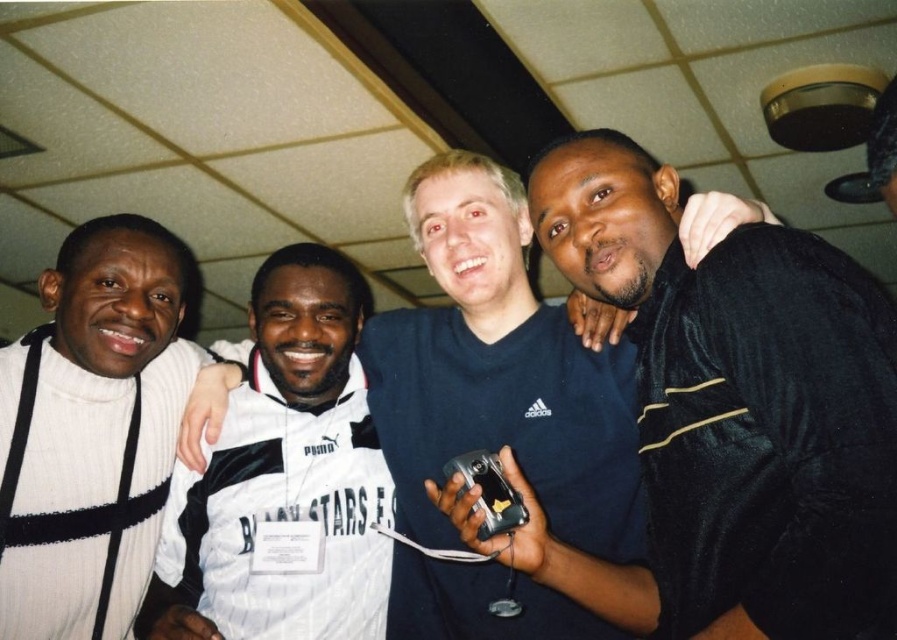
Question: Which object appears farthest from the camera in this image?

Choices:
 (A) white ribbed sweater at left
 (B) white jersey at center
 (C) white striped jersey at center

Answer: (C)

Question: Does black matte camera at center have a greater width compared to white striped jersey at center?

Choices:
 (A) no
 (B) yes

Answer: (B)

Question: Among these objects, which one is farthest from the camera?

Choices:
 (A) black matte camera at center
 (B) white jersey at center
 (C) white striped jersey at center

Answer: (C)

Question: Is the position of white ribbed sweater at left more distant than that of white striped jersey at center?

Choices:
 (A) yes
 (B) no

Answer: (B)

Question: Where is white jersey at center located in relation to white striped jersey at center in the image?

Choices:
 (A) below
 (B) above

Answer: (B)

Question: Which point is farther to the camera?

Choices:
 (A) (562, 340)
 (B) (53, 467)

Answer: (B)